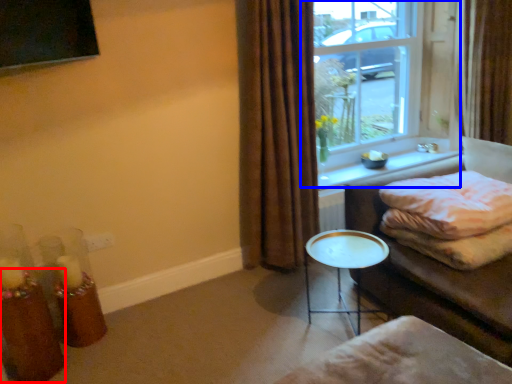
Question: Which object is closer to the camera taking this photo, candle holder (highlighted by a red box) or window (highlighted by a blue box)?

Choices:
 (A) candle holder
 (B) window

Answer: (A)